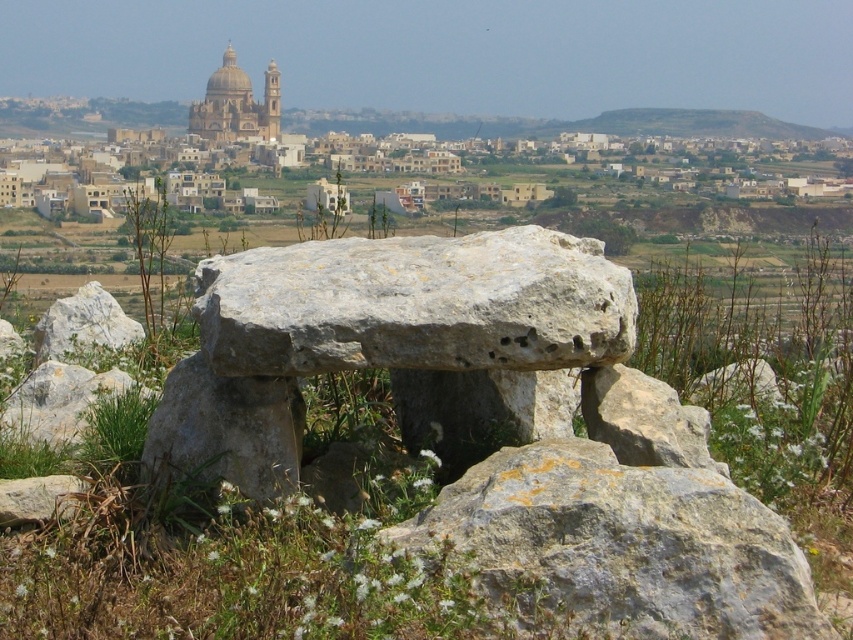
Question: Among these points, which one is nearest to the camera?

Choices:
 (A) (82, 291)
 (B) (239, 124)
 (C) (589, 362)

Answer: (C)

Question: Which of the following is the closest to the observer?

Choices:
 (A) gray rough rock at lower left
 (B) gray rough stone at center
 (C) golden stone dome at upper center

Answer: (B)

Question: From the image, what is the correct spatial relationship of gray rough stone at center in relation to golden stone dome at upper center?

Choices:
 (A) right
 (B) left

Answer: (A)

Question: Is gray rough rock at center positioned behind gray stone boulder at center?

Choices:
 (A) no
 (B) yes

Answer: (A)

Question: Can you confirm if gray rough rock at lower left is positioned below golden stone dome at upper center?

Choices:
 (A) yes
 (B) no

Answer: (A)

Question: Which point appears farthest from the camera in this image?

Choices:
 (A) (612, 282)
 (B) (556, 566)

Answer: (A)